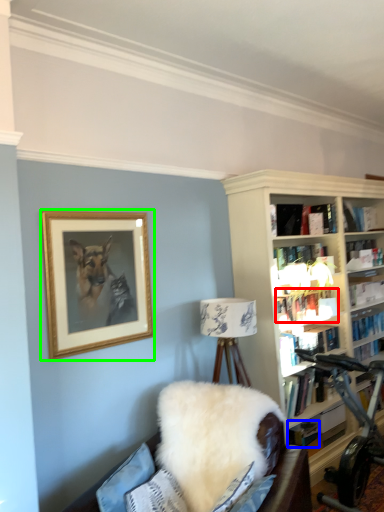
Question: Based on their relative distances, which object is farther from book (highlighted by a red box)? Choose from book (highlighted by a blue box) and picture frame (highlighted by a green box).

Choices:
 (A) book
 (B) picture frame

Answer: (B)